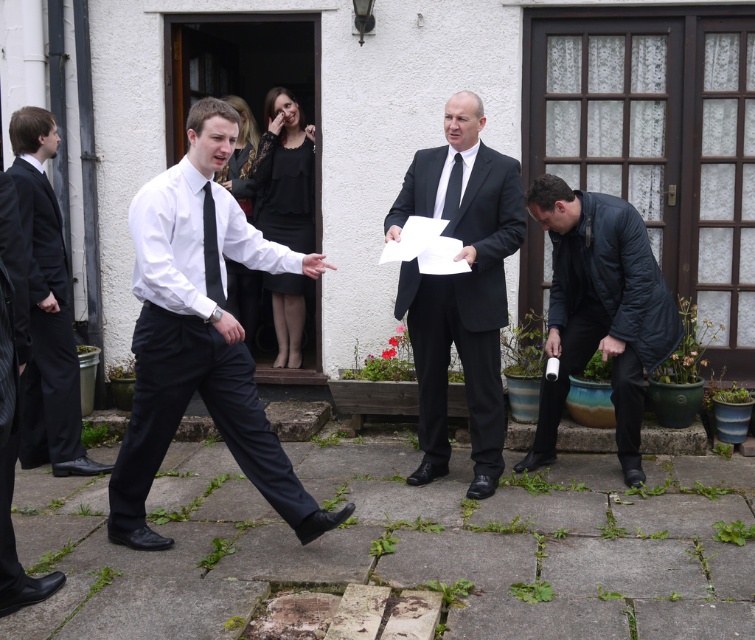
Question: Considering the real-world distances, which object is closest to the black satin tie at center?

Choices:
 (A) black silk tie at center
 (B) matte black suit at center

Answer: (B)

Question: Can you confirm if matte black suit at center is positioned above dark blue quilted jacket at lower right?

Choices:
 (A) yes
 (B) no

Answer: (A)

Question: Observing the image, what is the correct spatial positioning of dark blue quilted jacket at lower right in reference to matte black dress at center?

Choices:
 (A) above
 (B) below

Answer: (B)

Question: Which object is closer to the camera taking this photo?

Choices:
 (A) matte black suit at center
 (B) matte black suit at left
 (C) white glossy shirt at center

Answer: (C)

Question: Which point is farther to the camera?

Choices:
 (A) white glossy shirt at center
 (B) black silk tie at center

Answer: (B)

Question: Is the position of matte black suit at left more distant than that of black satin tie at center?

Choices:
 (A) yes
 (B) no

Answer: (A)